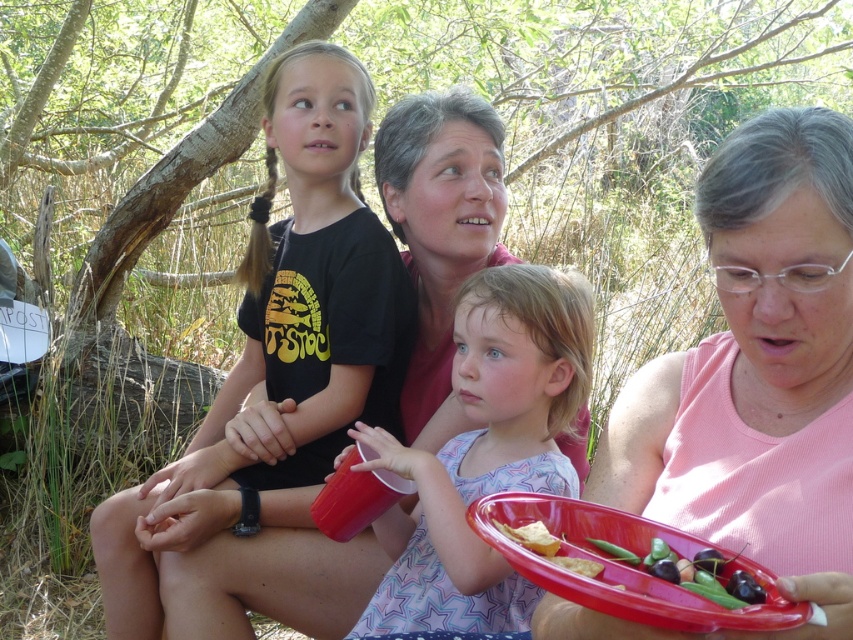
Between point (780, 360) and point (553, 284), which one is positioned behind?

The point (553, 284) is more distant.

Does pink fabric tray at right have a lesser height compared to pastel cotton dress at center?

Correct, pink fabric tray at right is not as tall as pastel cotton dress at center.

Find the location of `pink fabric tray at right`. pink fabric tray at right is located at coordinates (758, 371).

Is pink fabric tray at right smaller than black matte t-shirt at upper left?

Yes, pink fabric tray at right is smaller than black matte t-shirt at upper left.

Which is more to the left, pink fabric tray at right or black matte t-shirt at upper left?

black matte t-shirt at upper left

Locate an element on the screen. The image size is (853, 640). pink fabric tray at right is located at coordinates (758, 371).

Between pink fabric tray at right and golden crispy chips at lower center, which one appears on the left side from the viewer's perspective?

From the viewer's perspective, golden crispy chips at lower center appears more on the left side.

Which is above, pink fabric tray at right or golden crispy chips at lower center?

pink fabric tray at right is higher up.

In order to click on pink fabric tray at right in this screenshot , I will do pos(758,371).